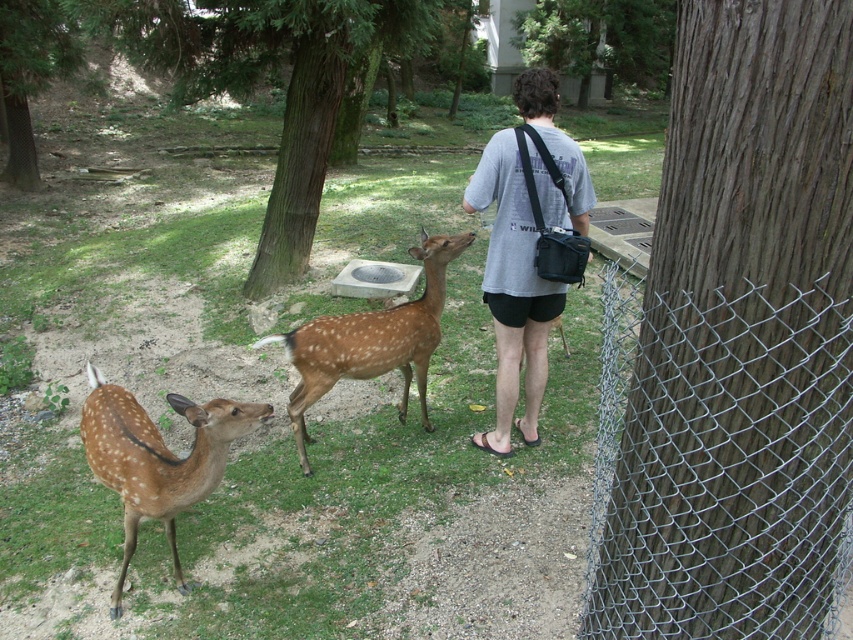
Question: Considering the real-world distances, which object is closest to the gray cotton shirt at center?

Choices:
 (A) green textured tree at upper left
 (B) spotted fur deer at lower left
 (C) brown rough bark tree at center right

Answer: (B)

Question: Does brown rough tree at center come in front of gray cotton shirt at center?

Choices:
 (A) no
 (B) yes

Answer: (A)

Question: Can you confirm if brown rough tree at center is bigger than brown spotted fur at center?

Choices:
 (A) yes
 (B) no

Answer: (A)

Question: Which of the following is the farthest from the observer?

Choices:
 (A) green textured tree at upper left
 (B) brown rough bark tree at center right
 (C) brown spotted fur at center
 (D) brown rough tree at center

Answer: (A)

Question: Does gray cotton shirt at center have a greater width compared to green textured tree at upper left?

Choices:
 (A) no
 (B) yes

Answer: (A)

Question: Which point appears closest to the camera in this image?

Choices:
 (A) (381, 337)
 (B) (279, 216)
 (C) (119, 452)

Answer: (C)